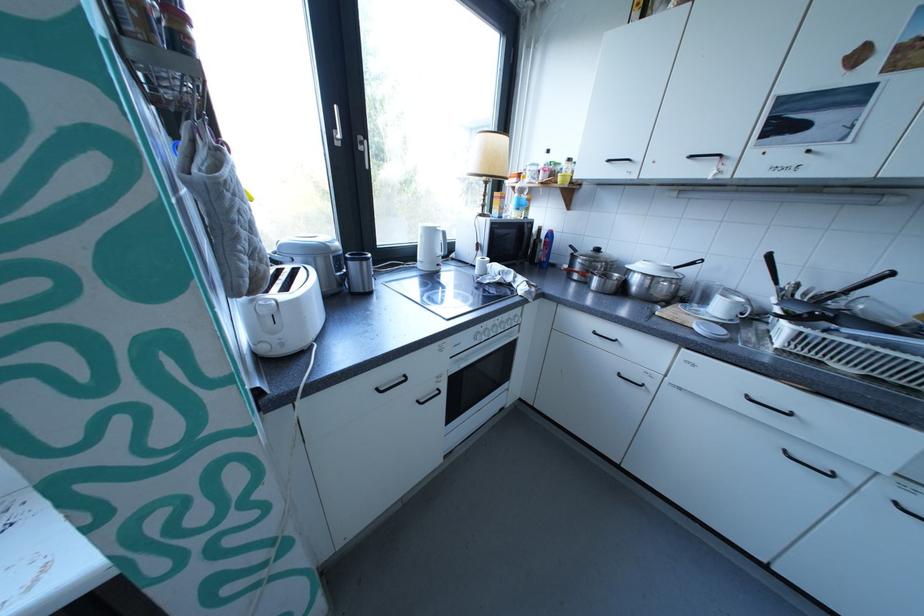
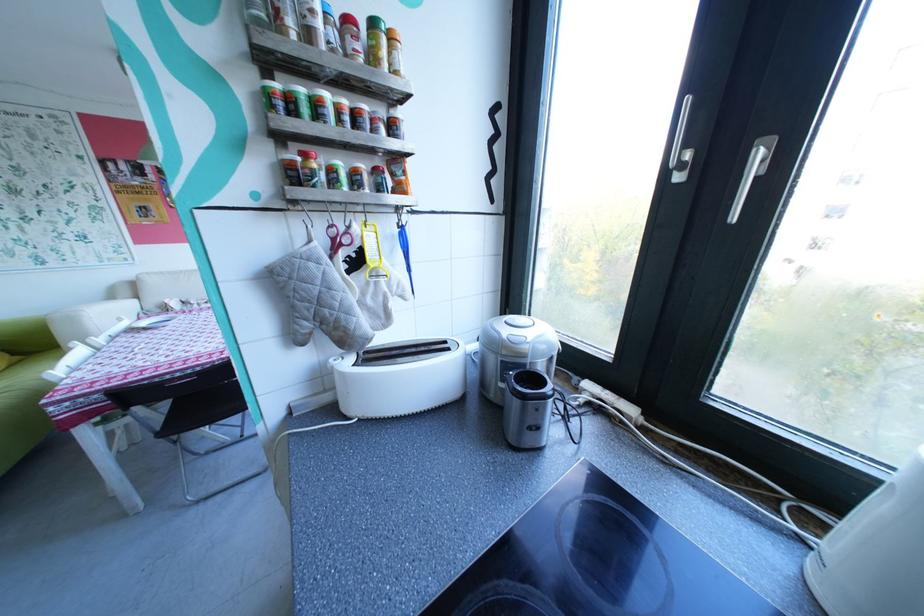
How did the camera likely rotate?

The rotation direction of the camera is left-down.